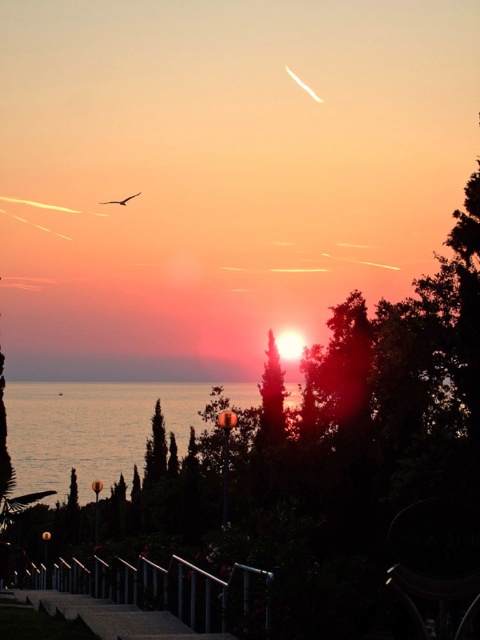
Is green matte tree at center shorter than matte black bird at upper center?

Correct, green matte tree at center is not as tall as matte black bird at upper center.

Between green matte tree at center and matte black bird at upper center, which one is positioned higher?

matte black bird at upper center is above.

You are a GUI agent. You are given a task and a screenshot of the screen. Output one action in this format:
    pyautogui.click(x=<x>, y=<y>)
    Task: Click on the green matte tree at center
    This screenshot has height=640, width=480.
    Given the screenshot: What is the action you would take?
    pyautogui.click(x=272, y=400)

Does point (135, 420) lie behind point (265, 352)?

Yes, point (135, 420) is behind point (265, 352).

Between point (37, 474) and point (276, 380), which one is positioned behind?

Point (37, 474)

Image resolution: width=480 pixels, height=640 pixels. What do you see at coordinates (93, 429) in the screenshot?
I see `transparent glass water at lower left` at bounding box center [93, 429].

In order to click on transparent glass water at lower left in this screenshot , I will do `click(93, 429)`.

In the scene shown: How distant is transparent glass water at lower left from matte black bird at upper center?

transparent glass water at lower left is 49.31 meters from matte black bird at upper center.

Based on the photo, is transparent glass water at lower left above matte black bird at upper center?

No.

Who is more distant from viewer, (145, 422) or (126, 196)?

Point (145, 422)

Find the location of a particular element. transparent glass water at lower left is located at coordinates (93, 429).